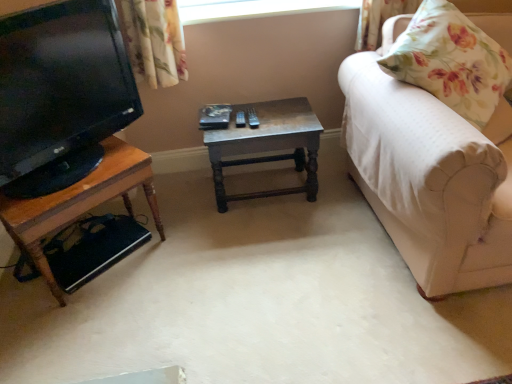
Question: Is wooden table at center, acting as the first table starting from the right, outside white fabric couch at right?

Choices:
 (A) yes
 (B) no

Answer: (A)

Question: From the image's perspective, does wooden table at center, acting as the first table starting from the right, appear higher than white fabric couch at right?

Choices:
 (A) no
 (B) yes

Answer: (A)

Question: Does wooden table at center, acting as the first table starting from the right, contain white fabric couch at right?

Choices:
 (A) no
 (B) yes

Answer: (A)

Question: Is wooden table at center, acting as the first table starting from the right, at the right side of white fabric couch at right?

Choices:
 (A) no
 (B) yes

Answer: (A)

Question: Considering the relative sizes of wooden table at center, positioned as the second table in left-to-right order, and white fabric couch at right in the image provided, is wooden table at center, positioned as the second table in left-to-right order, taller than white fabric couch at right?

Choices:
 (A) no
 (B) yes

Answer: (A)

Question: Relative to woodenobject at left, arranged as the second table when viewed from the right, is floral fabric pillow at right in front or behind?

Choices:
 (A) front
 (B) behind

Answer: (A)

Question: Is floral fabric pillow at right inside or outside of woodenobject at left, the 1th table positioned from the left?

Choices:
 (A) outside
 (B) inside

Answer: (A)

Question: Is point (457, 84) positioned closer to the camera than point (72, 208)?

Choices:
 (A) closer
 (B) farther

Answer: (A)

Question: In terms of height, does floral fabric pillow at right look taller or shorter compared to woodenobject at left, arranged as the second table when viewed from the right?

Choices:
 (A) tall
 (B) short

Answer: (A)

Question: From their relative heights in the image, would you say floral fabric pillow at right is taller or shorter than matte black tv at left?

Choices:
 (A) short
 (B) tall

Answer: (A)

Question: From a real-world perspective, is floral fabric pillow at right physically located above or below matte black tv at left?

Choices:
 (A) above
 (B) below

Answer: (B)

Question: Considering the relative positions of floral fabric pillow at right and matte black tv at left in the image provided, is floral fabric pillow at right to the left or to the right of matte black tv at left?

Choices:
 (A) right
 (B) left

Answer: (A)

Question: Looking at their shapes, would you say floral fabric pillow at right is wider or thinner than matte black tv at left?

Choices:
 (A) thin
 (B) wide

Answer: (B)

Question: Considering the positions of point (396, 225) and point (420, 76), is point (396, 225) closer or farther from the camera than point (420, 76)?

Choices:
 (A) farther
 (B) closer

Answer: (A)

Question: Looking at their shapes, would you say white fabric couch at right is wider or thinner than floral fabric pillow at right?

Choices:
 (A) thin
 (B) wide

Answer: (B)